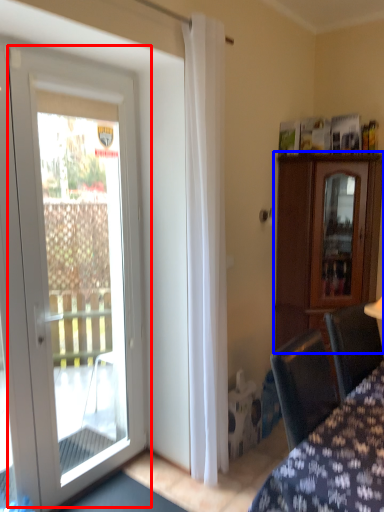
Question: Which object appears closest to the camera in this image, door (highlighted by a red box) or cabinetry (highlighted by a blue box)?

Choices:
 (A) door
 (B) cabinetry

Answer: (A)